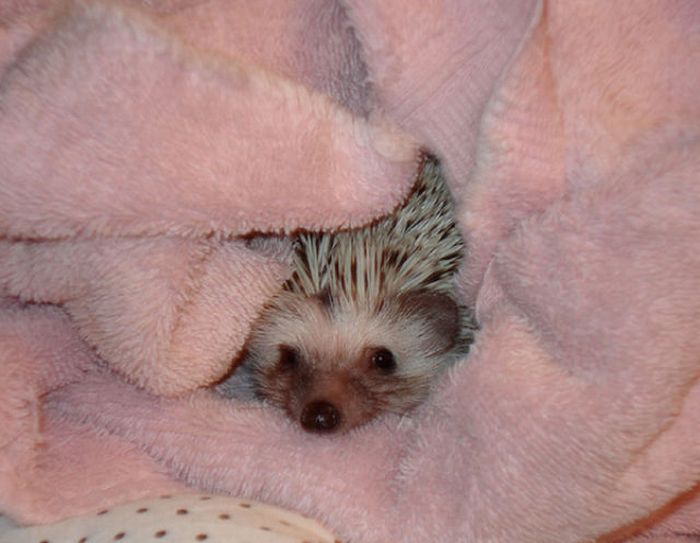
The width and height of the screenshot is (700, 543). Identify the location of gluffy pink blanket. (239, 180).